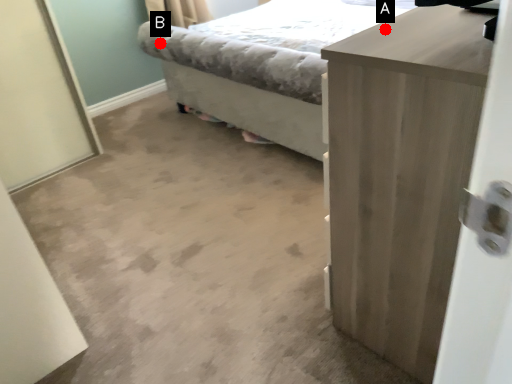
Question: Two points are circled on the image, labeled by A and B beside each circle. Which point is farther to the camera?

Choices:
 (A) A is further
 (B) B is further

Answer: (B)